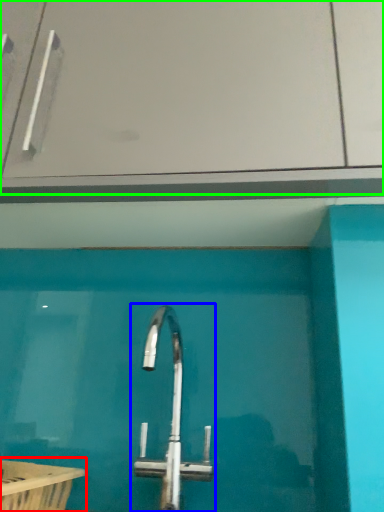
Question: Based on their relative distances, which object is nearer to bath (highlighted by a red box)? Choose from tap (highlighted by a blue box) and glass door (highlighted by a green box).

Choices:
 (A) tap
 (B) glass door

Answer: (A)